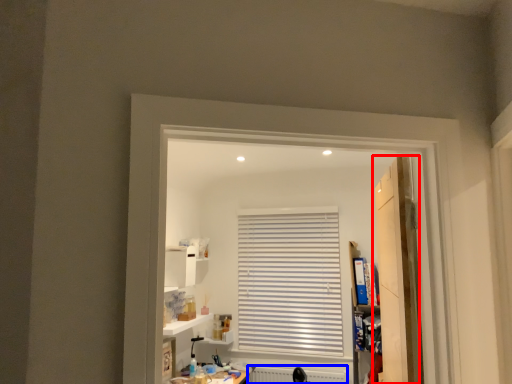
Question: Among these objects, which one is farthest to the camera, door (highlighted by a red box) or radiator (highlighted by a blue box)?

Choices:
 (A) door
 (B) radiator

Answer: (B)